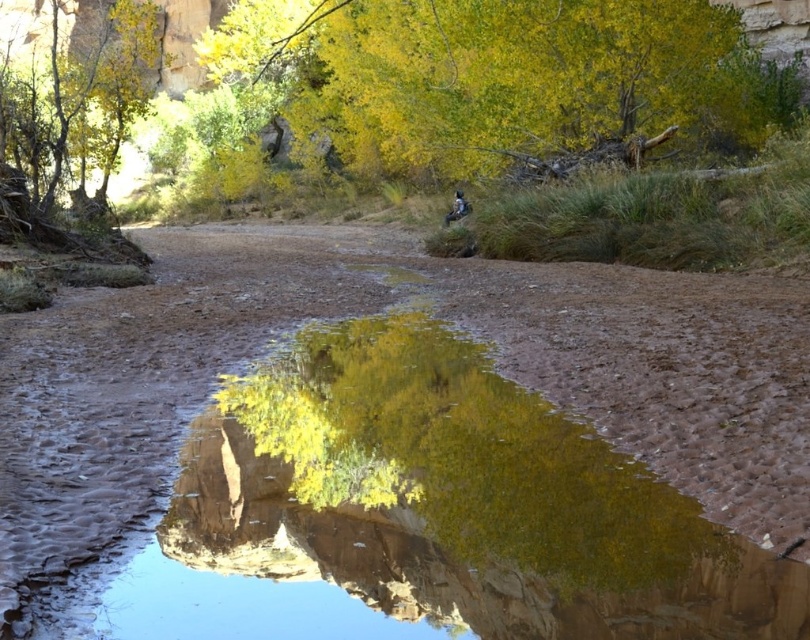
You are standing at the edge of the stream and notice a point labeled as point (401, 449). What type of water is located at that specific point?

The point (401, 449) has clear water at center.